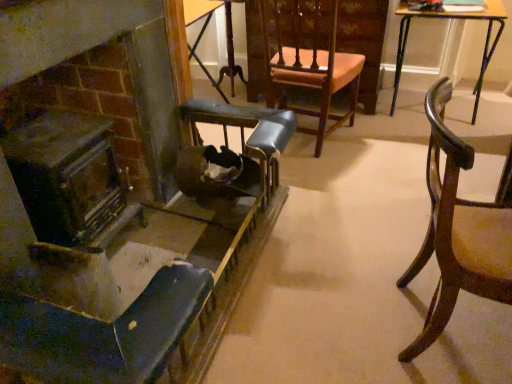
Describe the element at coordinates (460, 229) in the screenshot. This screenshot has height=384, width=512. I see `mahogany wood chair at right, the 1th chair in the right-to-left sequence` at that location.

Describe the element at coordinates (452, 19) in the screenshot. I see `wooden table at upper right, which ranks as the 2th table in left-to-right order` at that location.

I want to click on wooden table at center, marked as the 1th table in a left-to-right arrangement, so click(201, 30).

Is mahogany wood chair at right, the 1th chair in the right-to-left sequence, shorter than wooden table at upper right, which ranks as the 1th table in right-to-left order?

No, mahogany wood chair at right, the 1th chair in the right-to-left sequence, is not shorter than wooden table at upper right, which ranks as the 1th table in right-to-left order.

Considering their positions, is mahogany wood chair at right, the 1th chair in the right-to-left sequence, located in front of or behind wooden table at upper right, which ranks as the 1th table in right-to-left order?

In the image, mahogany wood chair at right, the 1th chair in the right-to-left sequence, appears in front of wooden table at upper right, which ranks as the 1th table in right-to-left order.

This screenshot has height=384, width=512. I want to click on the 1st table above the mahogany wood chair at right, the 1th chair in the right-to-left sequence (from the image's perspective), so click(x=452, y=19).

From the picture: Is mahogany wood chair at right, the 1th chair in the right-to-left sequence, aimed at wooden table at upper right, which ranks as the 2th table in left-to-right order?

No, mahogany wood chair at right, the 1th chair in the right-to-left sequence, is not aimed at wooden table at upper right, which ranks as the 2th table in left-to-right order.

Is metallic blue chair at left, the first chair from the left, in front of or behind dark brown wood fireplace at left in the image?

Clearly, metallic blue chair at left, the first chair from the left, is in front of dark brown wood fireplace at left.

Find the location of a particular element. fireplace behind the metallic blue chair at left, the first chair from the left is located at coordinates (70, 178).

Can you confirm if metallic blue chair at left, which is the third chair in right-to-left order, is bigger than dark brown wood fireplace at left?

Correct, metallic blue chair at left, which is the third chair in right-to-left order, is larger in size than dark brown wood fireplace at left.

From the image's perspective, is metallic blue chair at left, the first chair from the left, located above or below dark brown wood fireplace at left?

Clearly, from the image's perspective, metallic blue chair at left, the first chair from the left, is below dark brown wood fireplace at left.

Does wooden table at upper right, which ranks as the 1th table in right-to-left order, appear on the left side of wooden chair with upholstered seat at center, the 2th chair positioned from the right?

In fact, wooden table at upper right, which ranks as the 1th table in right-to-left order, is to the right of wooden chair with upholstered seat at center, the 2th chair positioned from the right.

Can you confirm if wooden table at upper right, which ranks as the 2th table in left-to-right order, is bigger than wooden chair with upholstered seat at center, the 2th chair positioned from the right?

Correct, wooden table at upper right, which ranks as the 2th table in left-to-right order, is larger in size than wooden chair with upholstered seat at center, the 2th chair positioned from the right.

At what (x,y) coordinates should I click in order to perform the action: click on chair that is the 1st one when counting downward from the wooden table at upper right, which ranks as the 2th table in left-to-right order (from the image's perspective). Please return your answer as a coordinate pair (x, y). The width and height of the screenshot is (512, 384). Looking at the image, I should click on (310, 60).

Looking at this image, from a real-world perspective, is wooden table at upper right, which ranks as the 2th table in left-to-right order, over wooden chair with upholstered seat at center, the 2th chair positioned from the right?

No, from a real-world perspective, wooden table at upper right, which ranks as the 2th table in left-to-right order, is not above wooden chair with upholstered seat at center, the 2th chair positioned from the right.

Can you confirm if mahogany wood chair at right, acting as the third chair starting from the left, is shorter than wooden chair with upholstered seat at center, the 2th chair positioned from the right?

Yes.

From the image's perspective, who appears lower, mahogany wood chair at right, acting as the third chair starting from the left, or wooden chair with upholstered seat at center, the 2th chair positioned from the left?

mahogany wood chair at right, acting as the third chair starting from the left, is shown below in the image.

Is mahogany wood chair at right, acting as the third chair starting from the left, smaller than wooden chair with upholstered seat at center, the 2th chair positioned from the right?

Correct, mahogany wood chair at right, acting as the third chair starting from the left, occupies less space than wooden chair with upholstered seat at center, the 2th chair positioned from the right.

Based on their positions, is wooden chair with upholstered seat at center, the 2th chair positioned from the right, located to the left or right of wooden table at upper right, which ranks as the 1th table in right-to-left order?

Clearly, wooden chair with upholstered seat at center, the 2th chair positioned from the right, is on the left of wooden table at upper right, which ranks as the 1th table in right-to-left order, in the image.

From the picture: Is wooden chair with upholstered seat at center, the 2th chair positioned from the left, smaller than wooden table at upper right, which ranks as the 1th table in right-to-left order?

Yes.

In the scene shown: Is wooden chair with upholstered seat at center, the 2th chair positioned from the right, beside wooden table at upper right, which ranks as the 1th table in right-to-left order?

There is a gap between wooden chair with upholstered seat at center, the 2th chair positioned from the right, and wooden table at upper right, which ranks as the 1th table in right-to-left order.

Is point (347, 56) in front of point (413, 12)?

Yes, point (347, 56) is in front of point (413, 12).

Who is bigger, dark brown wood fireplace at left or wooden table at upper right, which ranks as the 2th table in left-to-right order?

wooden table at upper right, which ranks as the 2th table in left-to-right order.

Is wooden table at upper right, which ranks as the 1th table in right-to-left order, inside dark brown wood fireplace at left?

Actually, wooden table at upper right, which ranks as the 1th table in right-to-left order, is outside dark brown wood fireplace at left.

Is dark brown wood fireplace at left next to wooden table at upper right, which ranks as the 2th table in left-to-right order, and touching it?

They are not placed beside each other.

You are a GUI agent. You are given a task and a screenshot of the screen. Output one action in this format:
    pyautogui.click(x=<x>, y=<y>)
    Task: Click on the fireplace below the wooden table at upper right, which ranks as the 2th table in left-to-right order (from the image's perspective)
    
    Given the screenshot: What is the action you would take?
    pyautogui.click(x=70, y=178)

Which is closer to the camera, (311, 42) or (204, 12)?

Point (311, 42) is closer to the camera than point (204, 12).

Is wooden chair with upholstered seat at center, the 2th chair positioned from the left, wider than wooden table at center, which is the 2th table in right-to-left order?

Yes.

Is wooden chair with upholstered seat at center, the 2th chair positioned from the left, facing towards wooden table at center, marked as the 1th table in a left-to-right arrangement?

No, wooden chair with upholstered seat at center, the 2th chair positioned from the left, is not facing towards wooden table at center, marked as the 1th table in a left-to-right arrangement.

Find the location of a particular element. The image size is (512, 384). table that is the 1st object located above the mahogany wood chair at right, acting as the third chair starting from the left (from the image's perspective) is located at coordinates (452, 19).

Find the location of a particular element. The image size is (512, 384). fireplace on the left side of metallic blue chair at left, which is the third chair in right-to-left order is located at coordinates (70, 178).

Consider the image. From the image, which object appears to be farther from wooden table at upper right, which ranks as the 1th table in right-to-left order, mahogany wood chair at right, the 1th chair in the right-to-left sequence, or dark brown wood fireplace at left?

dark brown wood fireplace at left.

From the image, which object appears to be farther from mahogany wood chair at right, acting as the third chair starting from the left, metallic blue chair at left, which is the third chair in right-to-left order, or wooden table at upper right, which ranks as the 2th table in left-to-right order?

The object further to mahogany wood chair at right, acting as the third chair starting from the left, is wooden table at upper right, which ranks as the 2th table in left-to-right order.

From the image, which object appears to be nearer to wooden table at center, which is the 2th table in right-to-left order, wooden table at upper right, which ranks as the 1th table in right-to-left order, or wooden chair with upholstered seat at center, the 2th chair positioned from the left?

wooden chair with upholstered seat at center, the 2th chair positioned from the left, is closer to wooden table at center, which is the 2th table in right-to-left order.

Which object lies further to the anchor point wooden chair with upholstered seat at center, the 2th chair positioned from the left, metallic blue chair at left, the first chair from the left, or mahogany wood chair at right, the 1th chair in the right-to-left sequence?

Among the two, mahogany wood chair at right, the 1th chair in the right-to-left sequence, is located further to wooden chair with upholstered seat at center, the 2th chair positioned from the left.

Which object lies nearer to the anchor point wooden chair with upholstered seat at center, the 2th chair positioned from the left, dark brown wood fireplace at left or metallic blue chair at left, which is the third chair in right-to-left order?

Based on the image, metallic blue chair at left, which is the third chair in right-to-left order, appears to be nearer to wooden chair with upholstered seat at center, the 2th chair positioned from the left.

Estimate the real-world distances between objects in this image. Which object is further from mahogany wood chair at right, acting as the third chair starting from the left, wooden table at upper right, which ranks as the 1th table in right-to-left order, or dark brown wood fireplace at left?

Among the two, wooden table at upper right, which ranks as the 1th table in right-to-left order, is located further to mahogany wood chair at right, acting as the third chair starting from the left.

Which object lies nearer to the anchor point wooden table at upper right, which ranks as the 1th table in right-to-left order, wooden chair with upholstered seat at center, the 2th chair positioned from the left, or mahogany wood chair at right, acting as the third chair starting from the left?

The object closer to wooden table at upper right, which ranks as the 1th table in right-to-left order, is wooden chair with upholstered seat at center, the 2th chair positioned from the left.

When comparing their distances from wooden table at upper right, which ranks as the 1th table in right-to-left order, does wooden table at center, which is the 2th table in right-to-left order, or dark brown wood fireplace at left seem further?

dark brown wood fireplace at left lies further to wooden table at upper right, which ranks as the 1th table in right-to-left order, than the other object.

This screenshot has height=384, width=512. I want to click on chair positioned between metallic blue chair at left, the first chair from the left, and wooden table at center, which is the 2th table in right-to-left order, from near to far, so click(310, 60).

Locate an element on the screen. Image resolution: width=512 pixels, height=384 pixels. chair between dark brown wood fireplace at left and wooden chair with upholstered seat at center, the 2th chair positioned from the left, from left to right is located at coordinates (129, 251).

Where is `table located between metallic blue chair at left, which is the third chair in right-to-left order, and wooden table at center, which is the 2th table in right-to-left order, in the depth direction`? table located between metallic blue chair at left, which is the third chair in right-to-left order, and wooden table at center, which is the 2th table in right-to-left order, in the depth direction is located at coordinates (452, 19).

This screenshot has width=512, height=384. Find the location of `chair between dark brown wood fireplace at left and wooden table at center, which is the 2th table in right-to-left order, in the front-back direction`. chair between dark brown wood fireplace at left and wooden table at center, which is the 2th table in right-to-left order, in the front-back direction is located at coordinates (310, 60).